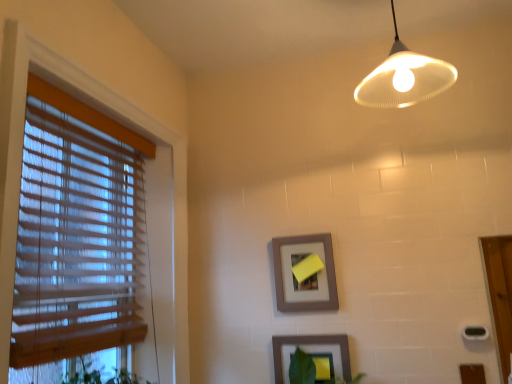
Question: From the image's perspective, is matte gray picture frame at center, the 1th picture frame from the top, located above or below wooden blinds at left?

Choices:
 (A) below
 (B) above

Answer: (A)

Question: In the image, is matte gray picture frame at center, the second picture frame from the bottom, positioned in front of or behind wooden blinds at left?

Choices:
 (A) front
 (B) behind

Answer: (B)

Question: Estimate the real-world distances between objects in this image. Which object is farther from the wooden blinds at left?

Choices:
 (A) matte gray picture frame at center, the second picture frame from the bottom
 (B) matte gray picture frame at lower center, the second picture frame from the top
 (C) matte white lampshade at upper center

Answer: (C)

Question: Which is nearer to the wooden blinds at left?

Choices:
 (A) matte gray picture frame at lower center, the second picture frame from the top
 (B) matte white lampshade at upper center
 (C) matte gray picture frame at center, the second picture frame from the bottom

Answer: (C)